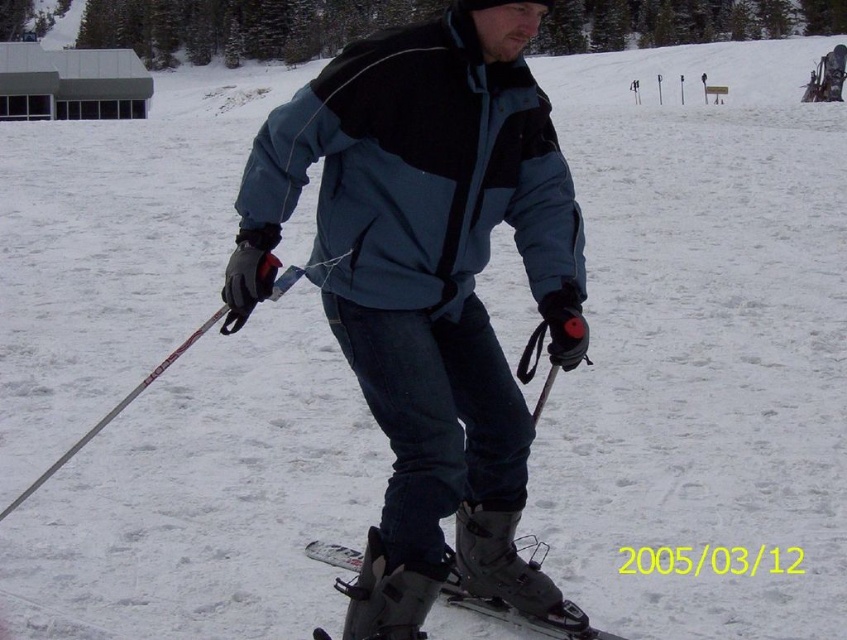
Between matte blue ski jacket at center and white plastic ski pole at left, which one has more height?

Standing taller between the two is matte blue ski jacket at center.

Is point (250, 234) positioned before point (82, 438)?

Yes, point (250, 234) is in front of point (82, 438).

The height and width of the screenshot is (640, 847). Find the location of `matte blue ski jacket at center`. matte blue ski jacket at center is located at coordinates (428, 284).

Which is behind, point (408, 157) or point (342, 568)?

Positioned behind is point (342, 568).

Between matte blue ski jacket at center and matte black ski at center, which one has more height?

matte blue ski jacket at center

You are a GUI agent. You are given a task and a screenshot of the screen. Output one action in this format:
    pyautogui.click(x=<x>, y=<y>)
    Task: Click on the matte blue ski jacket at center
    
    Given the screenshot: What is the action you would take?
    pyautogui.click(x=428, y=284)

Locate an element on the screen. matte blue ski jacket at center is located at coordinates (428, 284).

Does point (463, 604) come in front of point (54, 467)?

No, (463, 604) is further to viewer.

Is point (443, 600) behind point (270, 296)?

Yes, point (443, 600) is behind point (270, 296).

You are a GUI agent. You are given a task and a screenshot of the screen. Output one action in this format:
    pyautogui.click(x=<x>, y=<y>)
    Task: Click on the matte black ski at center
    
    Given the screenshot: What is the action you would take?
    pyautogui.click(x=508, y=611)

Find the location of `matte black ski at center`. matte black ski at center is located at coordinates (508, 611).